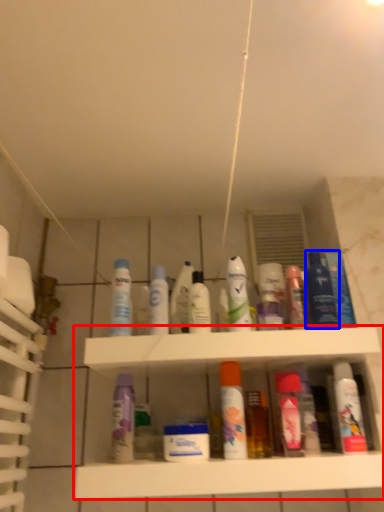
Question: Which object is closer to the camera taking this photo, shelf (highlighted by a red box) or mouthwash (highlighted by a blue box)?

Choices:
 (A) shelf
 (B) mouthwash

Answer: (A)